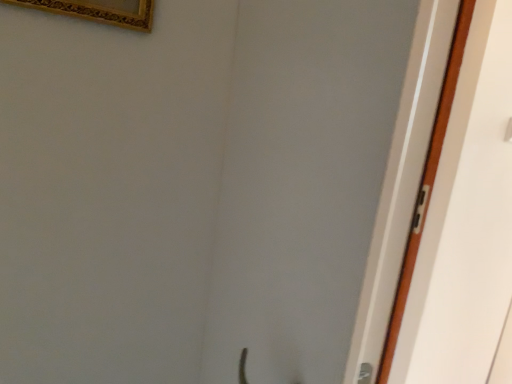
Identify the location of gold ornate picture frame at upper left. Image resolution: width=512 pixels, height=384 pixels. (99, 11).

What do you see at coordinates (99, 11) in the screenshot?
I see `gold ornate picture frame at upper left` at bounding box center [99, 11].

This screenshot has height=384, width=512. What are the coordinates of `gold ornate picture frame at upper left` in the screenshot? It's located at (99, 11).